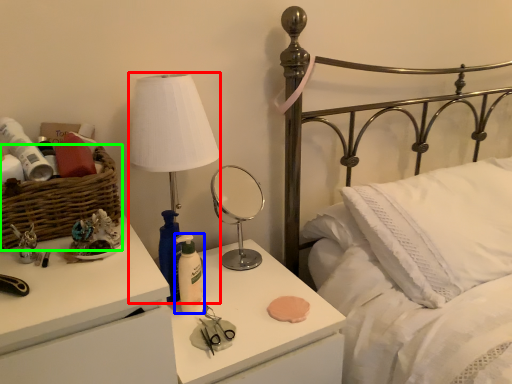
Question: Which is nearer to the table lamp (highlighted by a red box)? bottle (highlighted by a blue box) or basket (highlighted by a green box).

Choices:
 (A) bottle
 (B) basket

Answer: (B)